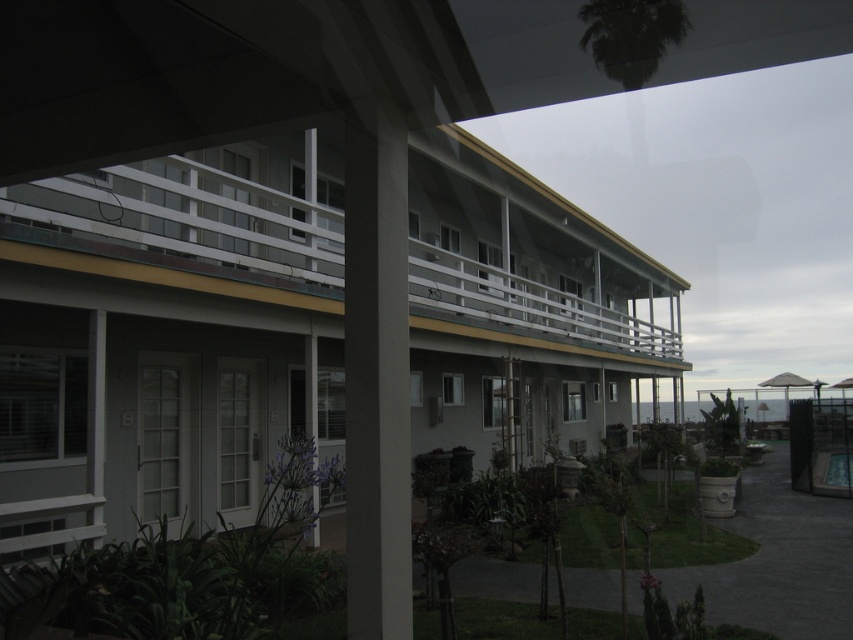
Who is shorter, white matte building at center or gray concrete pillar at center?

Standing shorter between the two is gray concrete pillar at center.

Does white matte building at center appear on the left side of gray concrete pillar at center?

In fact, white matte building at center is to the right of gray concrete pillar at center.

Is point (61, 276) positioned before point (387, 387)?

That is False.

Locate an element on the screen. This screenshot has height=640, width=853. white matte building at center is located at coordinates (166, 333).

Is the position of white painted wood balcony at upper center more distant than that of gray concrete pillar at center?

That is True.

Does white painted wood balcony at upper center appear under gray concrete pillar at center?

Incorrect, white painted wood balcony at upper center is not positioned below gray concrete pillar at center.

The image size is (853, 640). Find the location of `white painted wood balcony at upper center`. white painted wood balcony at upper center is located at coordinates (525, 268).

Locate an element on the screen. The image size is (853, 640). white painted wood balcony at upper center is located at coordinates (525, 268).

Does white matte building at center come in front of white painted wood balcony at upper center?

That is True.

Describe the element at coordinates (166, 333) in the screenshot. The height and width of the screenshot is (640, 853). I see `white matte building at center` at that location.

Find the location of a particular element. The width and height of the screenshot is (853, 640). white matte building at center is located at coordinates (166, 333).